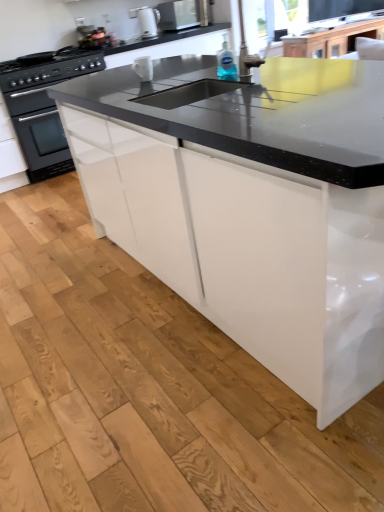
Question: Which direction should I rotate to face white glossy mug at upper center, the first appliance when ordered from bottom to top, — up or down?

Choices:
 (A) down
 (B) up

Answer: (B)

Question: Considering the relative sizes of white glossy mug at upper center, which appears as the first appliance when viewed from the right, and white glossy electric kettle at upper center, which is counted as the 2th appliance, starting from the right, in the image provided, is white glossy mug at upper center, which appears as the first appliance when viewed from the right, smaller than white glossy electric kettle at upper center, which is counted as the 2th appliance, starting from the right,?

Choices:
 (A) yes
 (B) no

Answer: (A)

Question: Does white glossy mug at upper center, positioned as the 2th appliance in top-to-bottom order, lie in front of white glossy electric kettle at upper center, marked as the 2th appliance in a bottom-to-top arrangement?

Choices:
 (A) yes
 (B) no

Answer: (A)

Question: Does white glossy mug at upper center, the first appliance when ordered from bottom to top, have a larger size compared to white glossy electric kettle at upper center, which is counted as the 2th appliance, starting from the right?

Choices:
 (A) yes
 (B) no

Answer: (B)

Question: Is white glossy mug at upper center, the second appliance when ordered from left to right, looking in the opposite direction of white glossy electric kettle at upper center, placed as the first appliance when sorted from back to front?

Choices:
 (A) no
 (B) yes

Answer: (A)

Question: Is white glossy mug at upper center, the 2th appliance when ordered from back to front, to the left of white glossy electric kettle at upper center, which appears as the 1th appliance when viewed from the top, from the viewer's perspective?

Choices:
 (A) no
 (B) yes

Answer: (A)

Question: From a real-world perspective, does white glossy mug at upper center, the first appliance when ordered from bottom to top, sit lower than white glossy electric kettle at upper center, which is counted as the 2th appliance, starting from the right?

Choices:
 (A) no
 (B) yes

Answer: (B)

Question: From the image's perspective, is white glossy electric kettle at upper center, placed as the first appliance when sorted from back to front, over black matte oven at left?

Choices:
 (A) no
 (B) yes

Answer: (B)

Question: Is white glossy electric kettle at upper center, arranged as the 1th appliance when viewed from the left, taller than black matte oven at left?

Choices:
 (A) yes
 (B) no

Answer: (B)

Question: Does white glossy electric kettle at upper center, marked as the 2th appliance in a bottom-to-top arrangement, turn towards black matte oven at left?

Choices:
 (A) no
 (B) yes

Answer: (A)

Question: Is white glossy electric kettle at upper center, placed as the first appliance when sorted from back to front, not inside black matte oven at left?

Choices:
 (A) no
 (B) yes

Answer: (B)

Question: Considering the relative sizes of white glossy electric kettle at upper center, which appears as the 1th appliance when viewed from the top, and black matte oven at left in the image provided, is white glossy electric kettle at upper center, which appears as the 1th appliance when viewed from the top, wider than black matte oven at left?

Choices:
 (A) no
 (B) yes

Answer: (A)

Question: Is white glossy electric kettle at upper center, positioned as the 2th appliance in front-to-back order, closer to the viewer compared to black matte oven at left?

Choices:
 (A) no
 (B) yes

Answer: (A)

Question: Would you say black matte oven at left is a long distance from white glossy electric kettle at upper center, marked as the 2th appliance in a bottom-to-top arrangement?

Choices:
 (A) yes
 (B) no

Answer: (A)